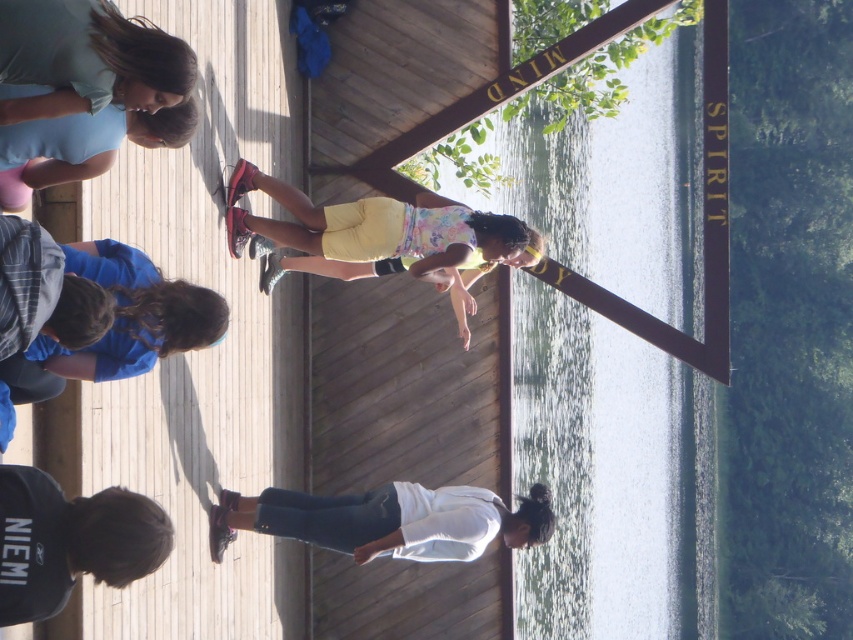
Question: Which of the following is the closest to the observer?

Choices:
 (A) (24, 186)
 (B) (123, 84)
 (C) (3, 486)

Answer: (C)

Question: Which of the following is the closest to the observer?

Choices:
 (A) yellow cotton shorts at center
 (B) white matte shirt at lower center

Answer: (B)

Question: In this image, where is matte blue shirt at upper left located relative to matte blue tank top at upper left?

Choices:
 (A) above
 (B) below

Answer: (A)

Question: Does yellow cotton shorts at center appear on the left side of black cotton hoodie at lower left?

Choices:
 (A) yes
 (B) no

Answer: (B)

Question: Observing the image, what is the correct spatial positioning of yellow cotton shorts at center in reference to matte blue shirt at upper left?

Choices:
 (A) below
 (B) above

Answer: (A)

Question: Estimate the real-world distances between objects in this image. Which object is farther from the yellow cotton shorts at center?

Choices:
 (A) black cotton hoodie at lower left
 (B) matte blue tank top at upper left

Answer: (A)